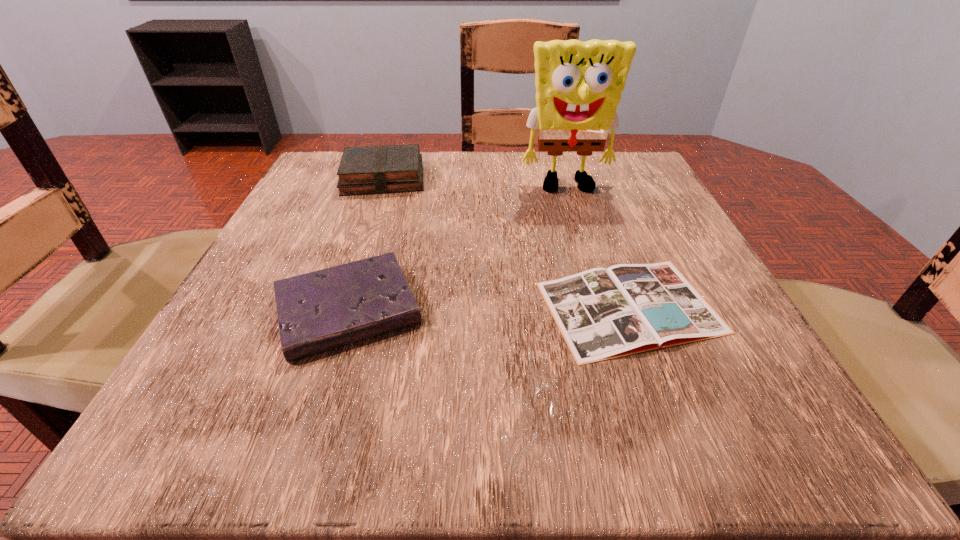
The height and width of the screenshot is (540, 960). I want to click on free spot between the sponge and the right book, so click(x=599, y=247).

At what (x,y) coordinates should I click in order to perform the action: click on vacant space that's between the sponge and the diary. Please return your answer as a coordinate pair (x, y). This screenshot has width=960, height=540. Looking at the image, I should click on [x=458, y=249].

You are a GUI agent. You are given a task and a screenshot of the screen. Output one action in this format:
    pyautogui.click(x=<x>, y=<y>)
    Task: Click on the free spot between the diary and the third shortest object
    
    Given the screenshot: What is the action you would take?
    click(366, 244)

Locate an element on the screen. Image resolution: width=960 pixels, height=540 pixels. vacant space that's between the shortest object and the second shortest object is located at coordinates (489, 308).

You are a GUI agent. You are given a task and a screenshot of the screen. Output one action in this format:
    pyautogui.click(x=<x>, y=<y>)
    Task: Click on the unoccupied area between the second tallest object and the sponge
    
    Given the screenshot: What is the action you would take?
    pyautogui.click(x=475, y=183)

The image size is (960, 540). In order to click on the second closest object to the nearer book in this screenshot , I will do `click(578, 84)`.

The width and height of the screenshot is (960, 540). Find the location of `the third closest object to the shorter book`. the third closest object to the shorter book is located at coordinates (382, 169).

The height and width of the screenshot is (540, 960). I want to click on vacant position in the image that satisfies the following two spatial constraints: 1. on the face of the shortest object; 2. on the right side of the sponge, so click(x=604, y=307).

Where is `free space that satisfies the following two spatial constraints: 1. on the face of the shortest object; 2. on the left side of the sponge`? free space that satisfies the following two spatial constraints: 1. on the face of the shortest object; 2. on the left side of the sponge is located at coordinates (604, 307).

This screenshot has height=540, width=960. In order to click on vacant space that satisfies the following two spatial constraints: 1. on the face of the right book; 2. on the left side of the tallest object in this screenshot , I will do (604, 307).